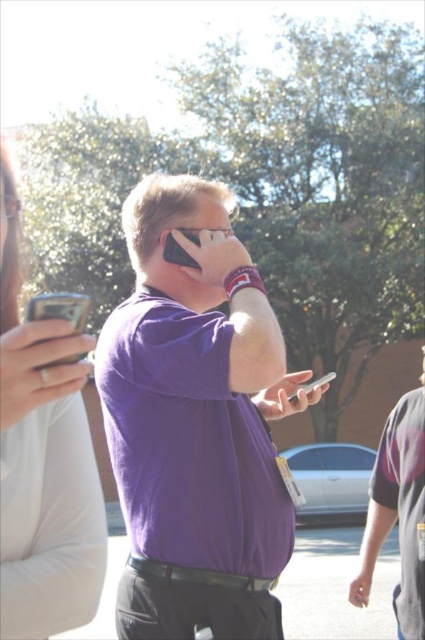
Can you confirm if matte black phone at upper center is positioned to the left of silver metallic phone at center?

Correct, you'll find matte black phone at upper center to the left of silver metallic phone at center.

Can you confirm if matte black phone at upper center is bigger than silver metallic phone at center?

Actually, matte black phone at upper center might be smaller than silver metallic phone at center.

Is point (187, 262) positioned before point (306, 392)?

That is True.

Identify the location of matte black phone at upper center. The width and height of the screenshot is (425, 640). (176, 253).

Which of these two, purple matte shirt at center or matte black smartphone at lower left, stands taller?

purple matte shirt at center

Is point (181, 236) farther from camera compared to point (79, 326)?

Yes, point (181, 236) is farther from viewer.

At what (x,y) coordinates should I click in order to perform the action: click on purple matte shirt at center. Please return your answer as a coordinate pair (x, y). The width and height of the screenshot is (425, 640). Looking at the image, I should click on (195, 422).

Which is above, matte black smartphone at lower left or matte black phone at upper center?

matte black smartphone at lower left

From the picture: Is matte black smartphone at lower left bigger than matte black phone at upper center?

Indeed, matte black smartphone at lower left has a larger size compared to matte black phone at upper center.

The height and width of the screenshot is (640, 425). I want to click on matte black smartphone at lower left, so click(59, 308).

This screenshot has width=425, height=640. I want to click on matte black smartphone at lower left, so click(x=59, y=308).